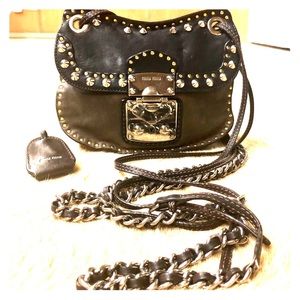
The width and height of the screenshot is (300, 300). I want to click on wall, so click(x=47, y=18).